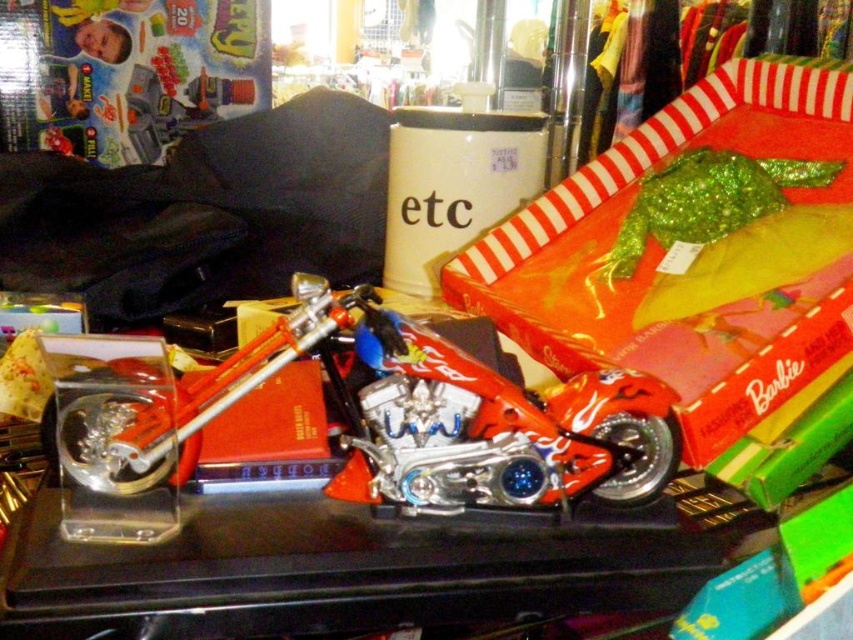
Question: Observing the image, what is the correct spatial positioning of shiny metallic motorcycle at center in reference to shiny red motorcycle at center?

Choices:
 (A) right
 (B) left

Answer: (B)

Question: Can you confirm if shiny metallic motorcycle at center is bigger than shiny red motorcycle at center?

Choices:
 (A) no
 (B) yes

Answer: (B)

Question: Observing the image, what is the correct spatial positioning of shiny metallic motorcycle at center in reference to shiny red motorcycle at center?

Choices:
 (A) above
 (B) below

Answer: (A)

Question: Among these objects, which one is farthest from the camera?

Choices:
 (A) shiny red motorcycle at center
 (B) shiny metallic motorcycle at center

Answer: (A)